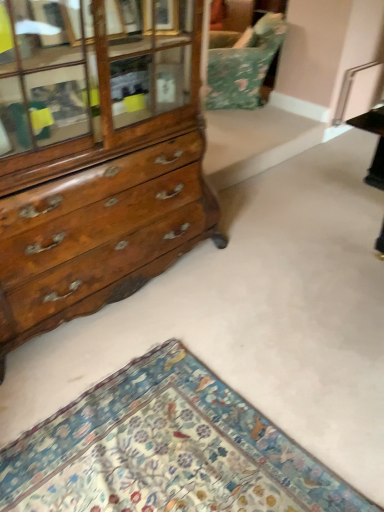
Question: Is the depth of wooden chest of drawers at left greater than that of floral carpet at lower left?

Choices:
 (A) yes
 (B) no

Answer: (A)

Question: Is floral carpet at lower left inside wooden chest of drawers at left?

Choices:
 (A) yes
 (B) no

Answer: (B)

Question: Considering the relative sizes of wooden chest of drawers at left and floral carpet at lower left in the image provided, is wooden chest of drawers at left wider than floral carpet at lower left?

Choices:
 (A) no
 (B) yes

Answer: (A)

Question: From the image's perspective, would you say wooden chest of drawers at left is shown under floral carpet at lower left?

Choices:
 (A) no
 (B) yes

Answer: (A)

Question: Is wooden chest of drawers at left to the left of floral carpet at lower left from the viewer's perspective?

Choices:
 (A) yes
 (B) no

Answer: (A)

Question: From the image's perspective, relative to wooden chest of drawers at left, is floral fabric swivel chair at upper center above or below?

Choices:
 (A) below
 (B) above

Answer: (B)

Question: Is floral fabric swivel chair at upper center inside the boundaries of wooden chest of drawers at left, or outside?

Choices:
 (A) outside
 (B) inside

Answer: (A)

Question: In the image, is floral fabric swivel chair at upper center positioned in front of or behind wooden chest of drawers at left?

Choices:
 (A) behind
 (B) front

Answer: (A)

Question: Is point (269, 34) positioned closer to the camera than point (44, 66)?

Choices:
 (A) farther
 (B) closer

Answer: (A)

Question: Is floral carpet at lower left spatially inside wooden chest of drawers at left, or outside of it?

Choices:
 (A) inside
 (B) outside

Answer: (B)

Question: Is point (112, 503) closer or farther from the camera than point (140, 102)?

Choices:
 (A) closer
 (B) farther

Answer: (A)

Question: From a real-world perspective, is floral carpet at lower left positioned above or below wooden chest of drawers at left?

Choices:
 (A) below
 (B) above

Answer: (A)

Question: Considering the relative positions of floral carpet at lower left and wooden chest of drawers at left in the image provided, is floral carpet at lower left to the left or to the right of wooden chest of drawers at left?

Choices:
 (A) right
 (B) left

Answer: (A)

Question: Would you say wooden chest of drawers at left is inside or outside floral fabric swivel chair at upper center?

Choices:
 (A) inside
 (B) outside

Answer: (B)

Question: Considering the positions of wooden chest of drawers at left and floral fabric swivel chair at upper center in the image, is wooden chest of drawers at left taller or shorter than floral fabric swivel chair at upper center?

Choices:
 (A) short
 (B) tall

Answer: (B)